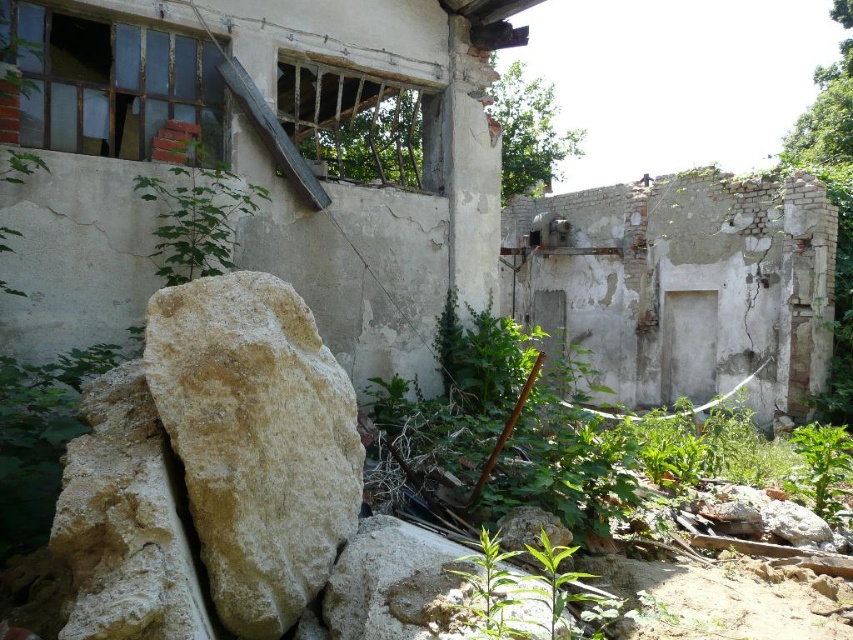
Question: Considering the real-world distances, which object is closest to the green leafy plant at lower right?

Choices:
 (A) green leafy plant at upper left
 (B) light beige stone at center

Answer: (B)

Question: Can you confirm if light beige stone at center is bigger than green leafy plant at lower right?

Choices:
 (A) yes
 (B) no

Answer: (A)

Question: Which is farther from the green leafy plant at upper left?

Choices:
 (A) green leafy plant at lower right
 (B) light beige stone at center

Answer: (A)

Question: Is light beige stone at center wider than green leafy plant at upper left?

Choices:
 (A) no
 (B) yes

Answer: (A)

Question: Does light beige stone at center lie behind green leafy plant at upper left?

Choices:
 (A) yes
 (B) no

Answer: (B)

Question: Which point appears farthest from the camera in this image?

Choices:
 (A) (804, 426)
 (B) (242, 204)

Answer: (A)